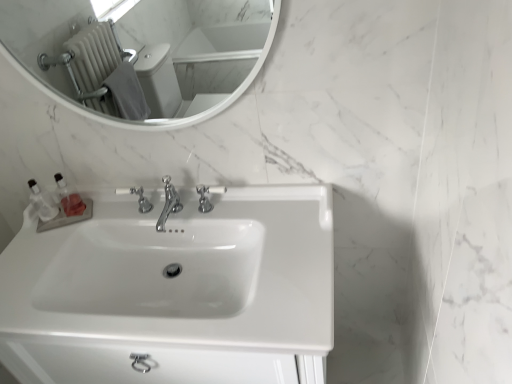
In order to click on vacant space that is in between clear plastic bottles at left, which is the second toiletry from left to right, and chrome metallic faucet at center, acting as the first tap starting from the left in this screenshot , I will do `click(104, 218)`.